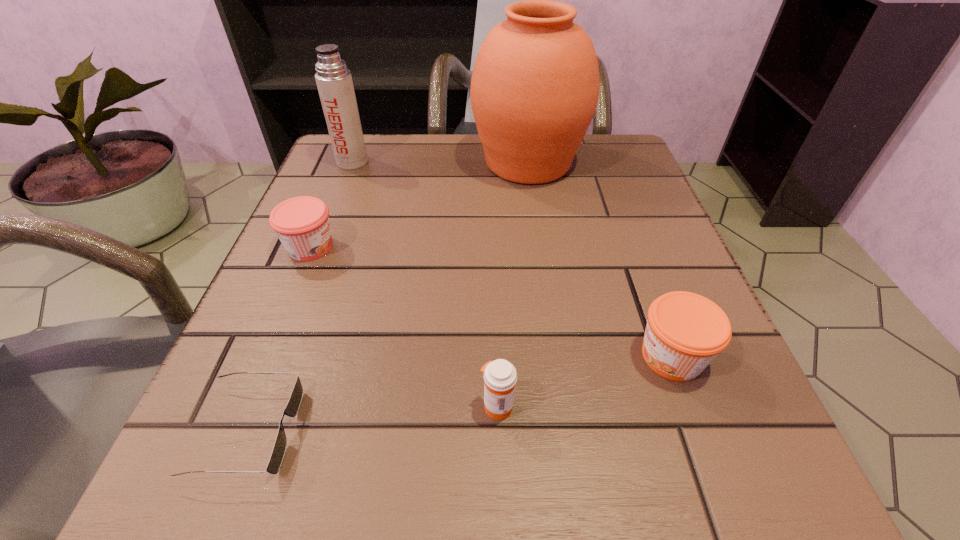
In order to click on blank space located on the front label of the nearer jam in this screenshot , I will do `click(398, 356)`.

This screenshot has width=960, height=540. Identify the location of free space located on the front label of the nearer jam. (480, 356).

This screenshot has width=960, height=540. I want to click on free location located on the front label of the nearer jam, so click(384, 356).

This screenshot has height=540, width=960. I want to click on vacant space located on the front label of the farther jam, so click(548, 247).

I want to click on free location located on the front-facing side of the sunglasses, so click(x=394, y=430).

At what (x,y) coordinates should I click in order to perform the action: click on urn that is at the far edge. Please return your answer as a coordinate pair (x, y). The image size is (960, 540). Looking at the image, I should click on click(535, 85).

What are the coordinates of `thermos bottle that is at the far edge` in the screenshot? It's located at (334, 81).

The image size is (960, 540). Identify the location of object at the near edge. [x=292, y=408].

This screenshot has width=960, height=540. Identify the location of thermos bottle that is at the left edge. (334, 81).

At what (x,y) coordinates should I click in order to perform the action: click on jam located in the left edge section of the desktop. Please return your answer as a coordinate pair (x, y). Looking at the image, I should click on (302, 224).